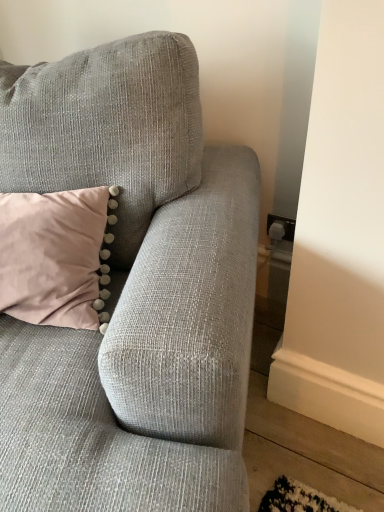
Describe the element at coordinates (132, 291) in the screenshot. I see `textured gray couch at upper left` at that location.

At what (x,y) coordinates should I click in order to perform the action: click on textured gray couch at upper left. Please return your answer as a coordinate pair (x, y). The height and width of the screenshot is (512, 384). Looking at the image, I should click on (132, 291).

Locate an element on the screen. This screenshot has height=512, width=384. textured gray couch at upper left is located at coordinates pos(132,291).